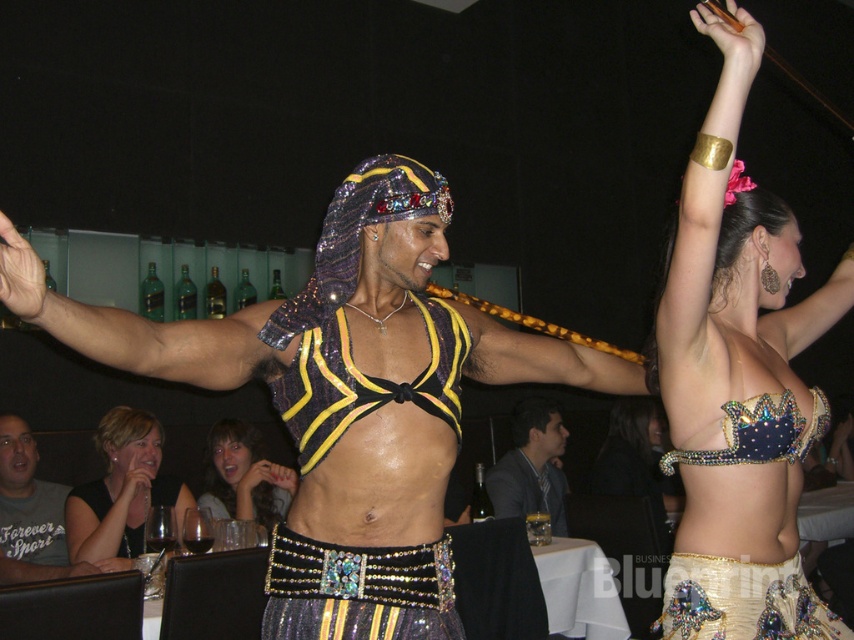
This screenshot has height=640, width=854. Describe the element at coordinates (344, 396) in the screenshot. I see `shiny sequined top at center` at that location.

Does point (39, 264) come in front of point (535, 422)?

Yes, it is in front of point (535, 422).

What do you see at coordinates (344, 396) in the screenshot? I see `shiny sequined top at center` at bounding box center [344, 396].

Locate an element on the screen. The width and height of the screenshot is (854, 640). shiny sequined top at center is located at coordinates (344, 396).

Does black fabric dress at lower left have a larger size compared to gray cotton t-shirt at lower left?

Correct, black fabric dress at lower left is larger in size than gray cotton t-shirt at lower left.

Between black fabric dress at lower left and gray cotton t-shirt at lower left, which one has more height?

Standing taller between the two is gray cotton t-shirt at lower left.

Does point (139, 538) come closer to viewer compared to point (50, 525)?

Yes, point (139, 538) is in front of point (50, 525).

Where is `black fabric dress at lower left`? This screenshot has width=854, height=640. black fabric dress at lower left is located at coordinates (121, 490).

Is shiny metallic arm at center closer to camera compared to shiny black hair at center?

Yes.

Between shiny metallic arm at center and shiny black hair at center, which one has more height?

shiny black hair at center

Does point (127, 344) come closer to viewer compared to point (260, 516)?

Yes, point (127, 344) is closer to viewer.

This screenshot has width=854, height=640. In order to click on shiny metallic arm at center in this screenshot , I will do `click(139, 328)`.